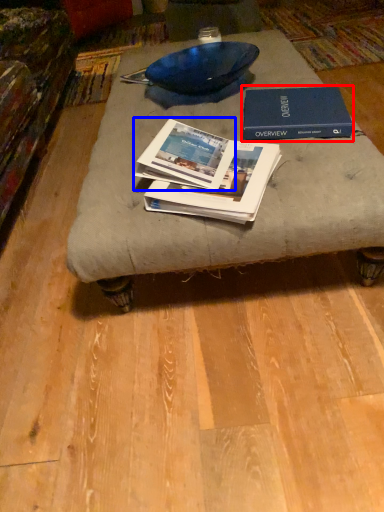
Question: Which object is further to the camera taking this photo, book (highlighted by a red box) or book (highlighted by a blue box)?

Choices:
 (A) book
 (B) book

Answer: (A)